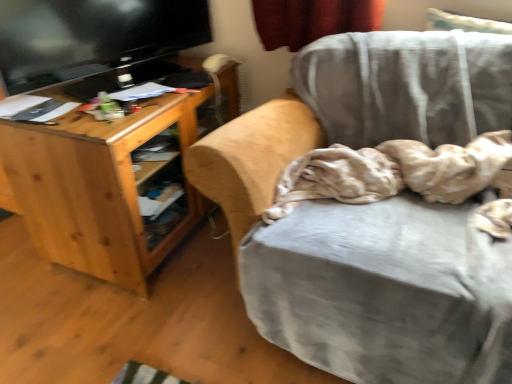
Question: Is natural wood desk at left smaller than beige soft fabric at center?

Choices:
 (A) yes
 (B) no

Answer: (B)

Question: From a real-world perspective, is natural wood desk at left positioned under beige soft fabric at center based on gravity?

Choices:
 (A) no
 (B) yes

Answer: (B)

Question: Can you confirm if natural wood desk at left is positioned to the left of beige soft fabric at center?

Choices:
 (A) yes
 (B) no

Answer: (A)

Question: Is natural wood desk at left in contact with beige soft fabric at center?

Choices:
 (A) no
 (B) yes

Answer: (A)

Question: Is natural wood desk at left far from beige soft fabric at center?

Choices:
 (A) yes
 (B) no

Answer: (B)

Question: Based on their positions, is beige soft fabric at center located to the left or right of velvet gray chair at center?

Choices:
 (A) right
 (B) left

Answer: (A)

Question: From the image's perspective, is beige soft fabric at center above or below velvet gray chair at center?

Choices:
 (A) below
 (B) above

Answer: (B)

Question: Do you think beige soft fabric at center is within velvet gray chair at center, or outside of it?

Choices:
 (A) outside
 (B) inside

Answer: (B)

Question: Is point (332, 158) closer or farther from the camera than point (346, 117)?

Choices:
 (A) farther
 (B) closer

Answer: (B)

Question: Is beige soft fabric at center taller or shorter than natural wood desk at left?

Choices:
 (A) short
 (B) tall

Answer: (A)

Question: From the image's perspective, is beige soft fabric at center above or below natural wood desk at left?

Choices:
 (A) above
 (B) below

Answer: (B)

Question: From a real-world perspective, is beige soft fabric at center above or below natural wood desk at left?

Choices:
 (A) below
 (B) above

Answer: (B)

Question: Based on their sizes in the image, would you say beige soft fabric at center is bigger or smaller than natural wood desk at left?

Choices:
 (A) small
 (B) big

Answer: (A)

Question: Based on their positions, is velvet gray chair at center located to the left or right of beige soft fabric at center?

Choices:
 (A) left
 (B) right

Answer: (A)

Question: From the image's perspective, relative to beige soft fabric at center, is velvet gray chair at center above or below?

Choices:
 (A) below
 (B) above

Answer: (A)